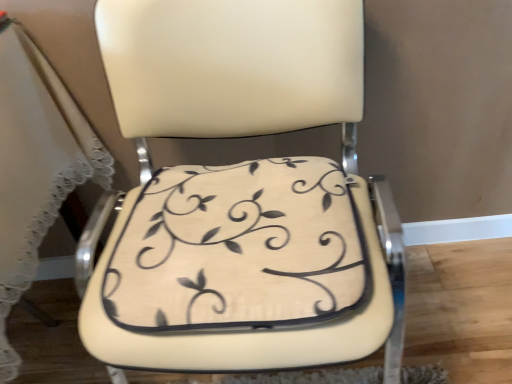
Question: Considering the positions of point (135, 314) and point (354, 36), is point (135, 314) closer or farther from the camera than point (354, 36)?

Choices:
 (A) closer
 (B) farther

Answer: (A)

Question: In the image, is beige fabric cushion at center on the left side or the right side of beige leather chair at center?

Choices:
 (A) left
 (B) right

Answer: (A)

Question: Is beige fabric cushion at center in front of or behind beige leather chair at center in the image?

Choices:
 (A) behind
 (B) front

Answer: (A)

Question: In the image, is beige leather chair at center positioned in front of or behind beige fabric cushion at center?

Choices:
 (A) front
 (B) behind

Answer: (A)

Question: Is point (220, 249) positioned closer to the camera than point (126, 233)?

Choices:
 (A) closer
 (B) farther

Answer: (A)

Question: From a real-world perspective, relative to beige fabric cushion at center, is beige leather chair at center vertically above or below?

Choices:
 (A) above
 (B) below

Answer: (B)

Question: From their relative heights in the image, would you say beige leather chair at center is taller or shorter than beige fabric cushion at center?

Choices:
 (A) short
 (B) tall

Answer: (B)